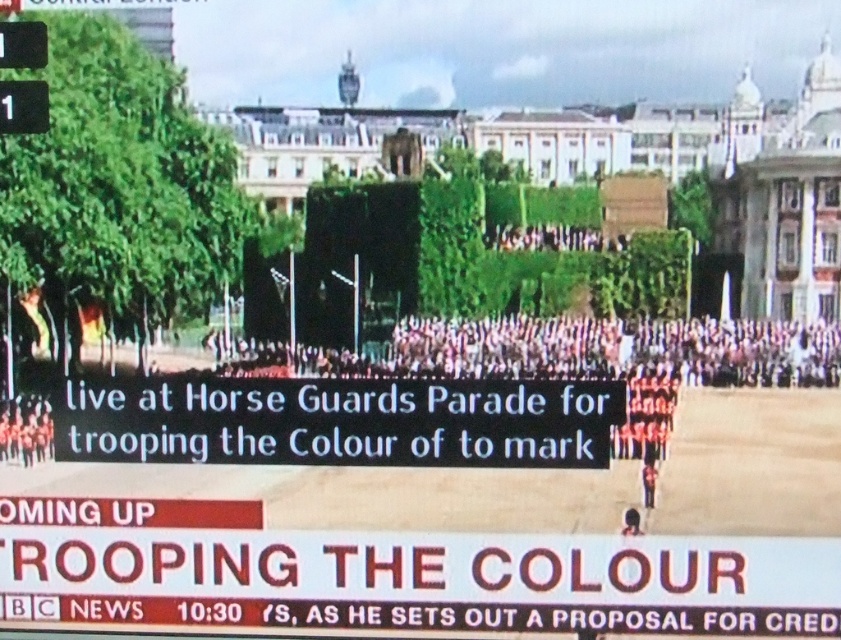
Is black plastic sign at center to the right of red uniform at center from the viewer's perspective?

Incorrect, black plastic sign at center is not on the right side of red uniform at center.

Describe the element at coordinates (337, 420) in the screenshot. This screenshot has height=640, width=841. I see `black plastic sign at center` at that location.

What are the coordinates of `black plastic sign at center` in the screenshot? It's located at (337, 420).

You are a GUI agent. You are given a task and a screenshot of the screen. Output one action in this format:
    pyautogui.click(x=<x>, y=<y>)
    Task: Click on the black plastic sign at center
    
    Given the screenshot: What is the action you would take?
    pyautogui.click(x=337, y=420)

Based on the photo, can you confirm if black plastic sign at center is thinner than pink fabric crowd at center?

Yes, black plastic sign at center is thinner than pink fabric crowd at center.

Locate an element on the screen. Image resolution: width=841 pixels, height=640 pixels. black plastic sign at center is located at coordinates (337, 420).

Looking at this image, between pink fabric crowd at center and red uniform at center, which one has less height?

Standing shorter between the two is red uniform at center.

The image size is (841, 640). Describe the element at coordinates (574, 352) in the screenshot. I see `pink fabric crowd at center` at that location.

Find the location of a particular element. This screenshot has width=841, height=640. pink fabric crowd at center is located at coordinates (574, 352).